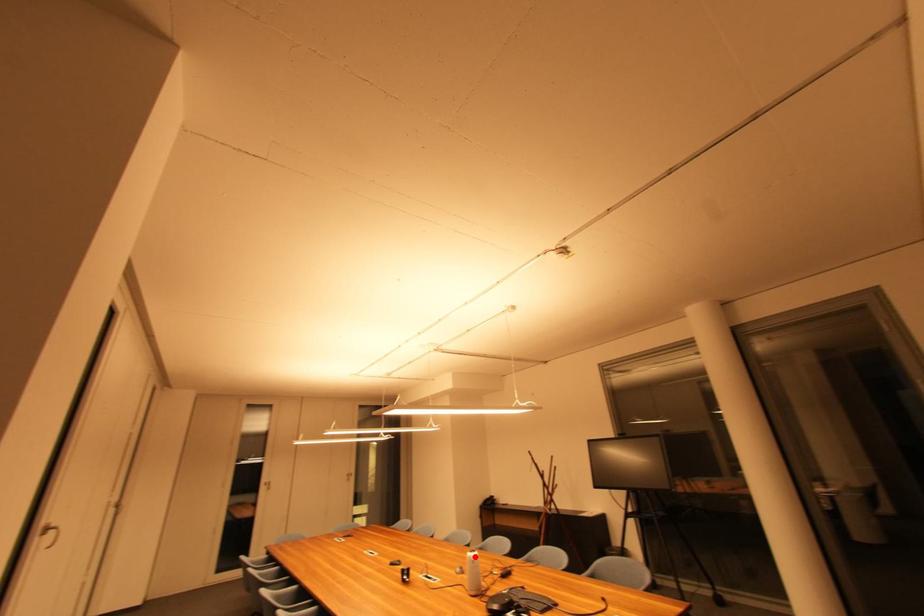
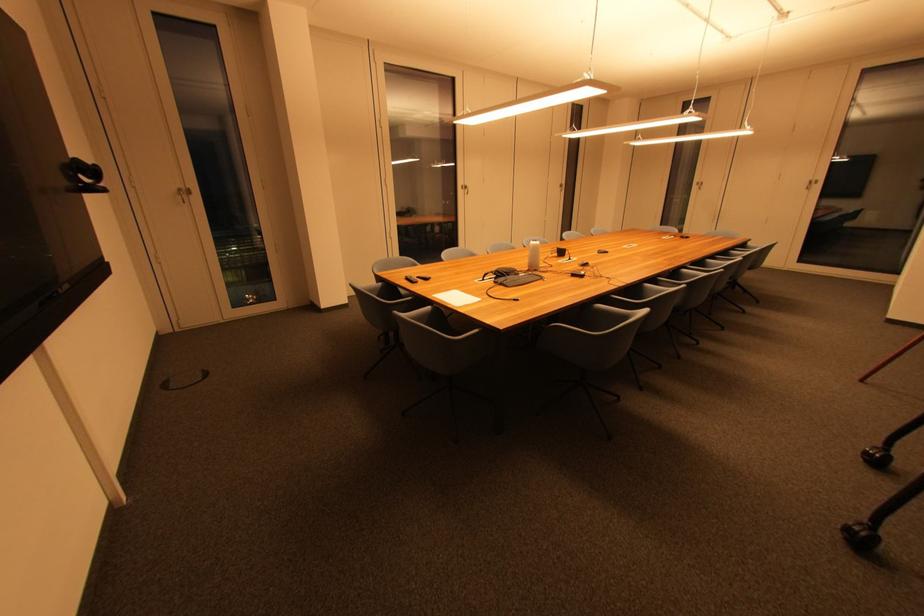
Find the pixel in the second image that matches the highlighted location in the first image.

(538, 244)